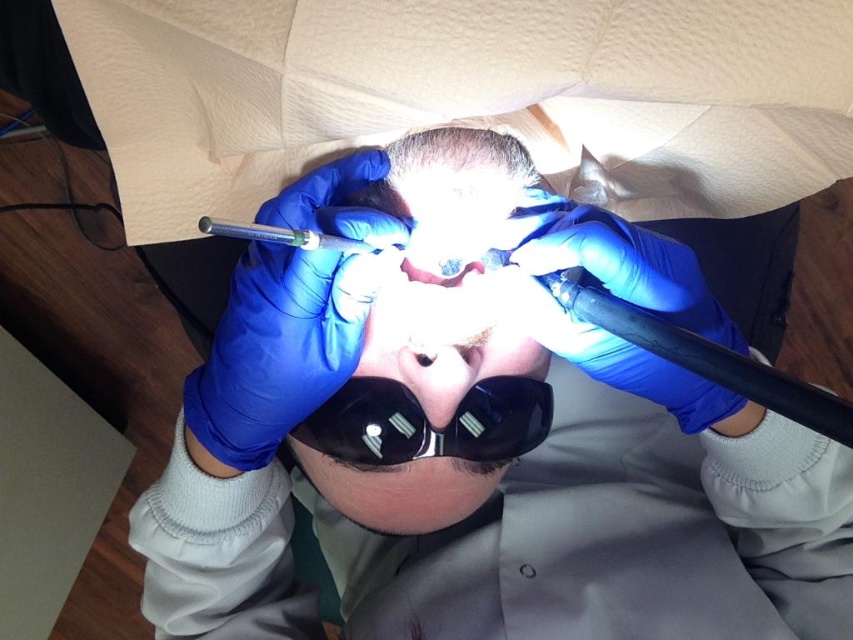
Question: Is blue rubber gloves at center further to camera compared to pink rubber mouth at center?

Choices:
 (A) yes
 (B) no

Answer: (B)

Question: Based on their relative distances, which object is farther from the matte black nose at center?

Choices:
 (A) blue rubber gloves at center
 (B) pink rubber mouth at center
 (C) translucent plastic eye at center
 (D) black matte goggles at center

Answer: (A)

Question: Is the position of matte black nose at center more distant than that of translucent plastic eye at center?

Choices:
 (A) yes
 (B) no

Answer: (B)

Question: Which object is closer to the camera taking this photo?

Choices:
 (A) blue rubber gloves at center
 (B) matte black nose at center
 (C) pink rubber mouth at center

Answer: (A)

Question: Which of the following is the farthest from the observer?

Choices:
 (A) matte black nose at center
 (B) translucent plastic eye at center
 (C) black matte goggles at center
 (D) pink rubber mouth at center

Answer: (C)

Question: Is matte black nose at center above translucent plastic eye at center?

Choices:
 (A) no
 (B) yes

Answer: (A)